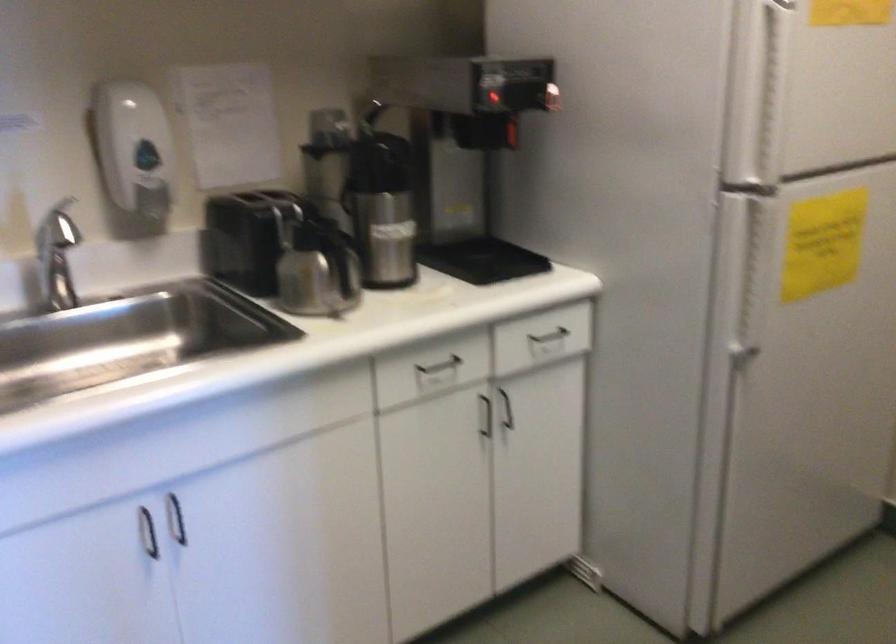
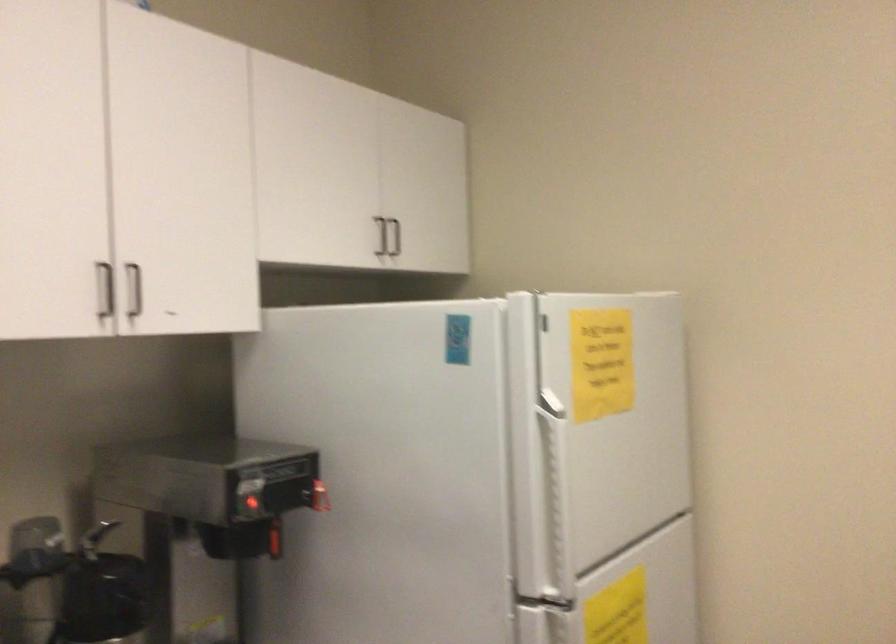
The point at (757, 213) is marked in the first image. Where is the corresponding point in the second image?

(558, 627)